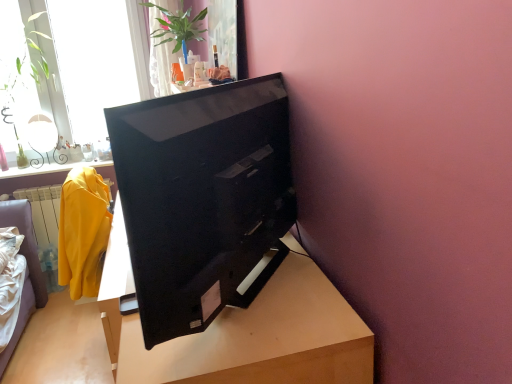
Question: Is green leafy plant at upper left at the left side of transparent glass window at upper left?

Choices:
 (A) yes
 (B) no

Answer: (A)

Question: From the image's perspective, is green leafy plant at upper left under transparent glass window at upper left?

Choices:
 (A) yes
 (B) no

Answer: (A)

Question: Does green leafy plant at upper left turn towards transparent glass window at upper left?

Choices:
 (A) yes
 (B) no

Answer: (B)

Question: Is green leafy plant at upper left completely or partially outside of transparent glass window at upper left?

Choices:
 (A) yes
 (B) no

Answer: (A)

Question: Is green leafy plant at upper left not close to transparent glass window at upper left?

Choices:
 (A) yes
 (B) no

Answer: (B)

Question: From the image's perspective, would you say green leafy plant at upper left is positioned over transparent glass window at upper left?

Choices:
 (A) yes
 (B) no

Answer: (B)

Question: Considering the relative sizes of green glossy plant at upper center and green leafy plant at upper left in the image provided, is green glossy plant at upper center wider than green leafy plant at upper left?

Choices:
 (A) yes
 (B) no

Answer: (A)

Question: From the image's perspective, does green glossy plant at upper center appear lower than green leafy plant at upper left?

Choices:
 (A) no
 (B) yes

Answer: (A)

Question: Is green glossy plant at upper center next to green leafy plant at upper left and touching it?

Choices:
 (A) yes
 (B) no

Answer: (B)

Question: Does green glossy plant at upper center have a lesser width compared to green leafy plant at upper left?

Choices:
 (A) no
 (B) yes

Answer: (A)

Question: From a real-world perspective, does green glossy plant at upper center stand above green leafy plant at upper left?

Choices:
 (A) yes
 (B) no

Answer: (A)

Question: Is green glossy plant at upper center positioned with its back to green leafy plant at upper left?

Choices:
 (A) no
 (B) yes

Answer: (A)

Question: Considering the relative sizes of wooden table at center and transparent glass window at upper left in the image provided, is wooden table at center wider than transparent glass window at upper left?

Choices:
 (A) no
 (B) yes

Answer: (B)